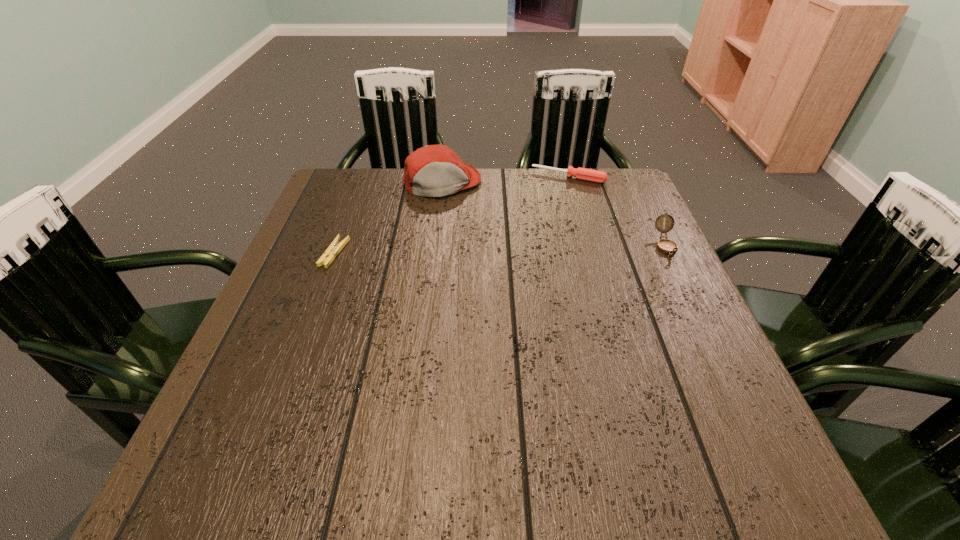
At what (x,y) coordinates should I click in order to perform the action: click on unoccupied position between the second object from right to left and the shortest object. Please return your answer as a coordinate pair (x, y). The width and height of the screenshot is (960, 540). Looking at the image, I should click on pyautogui.click(x=451, y=215).

Find the location of a particular element. Image resolution: width=960 pixels, height=540 pixels. vacant space that's between the cap and the screwdriver is located at coordinates (x=505, y=180).

You are a GUI agent. You are given a task and a screenshot of the screen. Output one action in this format:
    pyautogui.click(x=<x>, y=<y>)
    Task: Click on the vacant area that lies between the cap and the second object from right to left
    
    Given the screenshot: What is the action you would take?
    pyautogui.click(x=505, y=180)

Identify the location of free space that is in between the third object from left to right and the clothespin. (451, 215).

Where is `free space between the leftmost object and the second object from left to right`? The image size is (960, 540). free space between the leftmost object and the second object from left to right is located at coordinates (388, 219).

Identify the location of vacant region between the third object from right to left and the second object from right to left. (505, 180).

You are a GUI agent. You are given a task and a screenshot of the screen. Output one action in this format:
    pyautogui.click(x=<x>, y=<y>)
    Task: Click on the vacant space in between the shortest object and the compass
    
    Given the screenshot: What is the action you would take?
    pyautogui.click(x=500, y=250)

Identify the location of empty space that is in between the screwdriver and the second object from left to right. (505, 180).

Identify the location of the third closest object to the third shortest object. This screenshot has height=540, width=960. (333, 250).

This screenshot has width=960, height=540. What are the coordinates of `object that stands as the closest to the second object from left to right` in the screenshot? It's located at point(585,174).